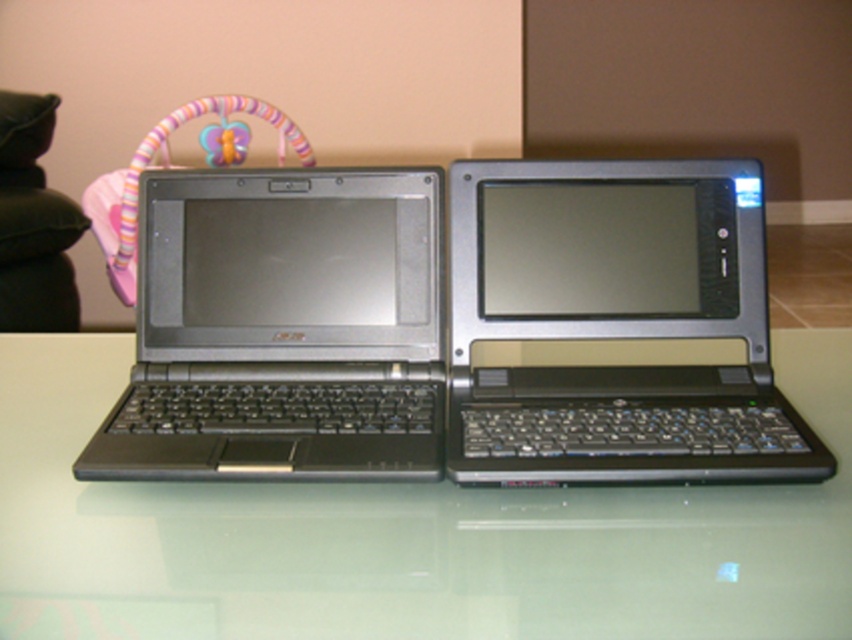
You are standing in front of two laptops on a glass table. You notice two points marked on the table surface. One is at point [419,544] and the other at point [246,432]. Which point is closer to you?

Point [419,544] is in front of point [246,432], so it is closer to you.

You are setting up a presentation and need to place a projector screen behind one of the laptops. The projector screen will be placed at coordinate point 0.5, 0.3. Which laptop, the black matte laptop at left or the other laptop, should you position the projector screen behind to ensure it aligns properly?

The black matte laptop at left is located at point (283, 328), so the projector screen at (255, 320) is closer to the black matte laptop at left. Therefore, you should position the projector screen behind the black matte laptop at left to ensure proper alignment.